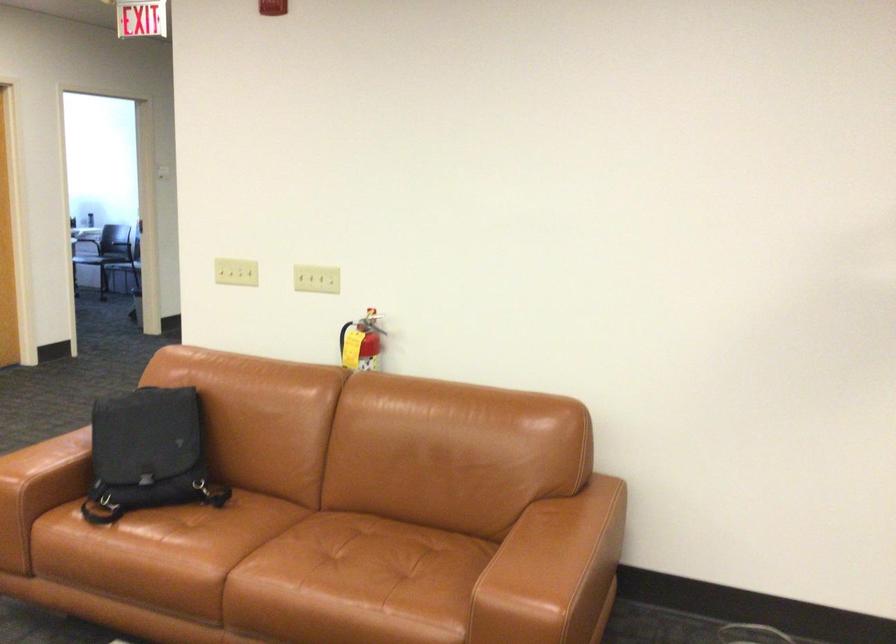
At what (x,y) coordinates should I click in order to perform the action: click on sofa sitting surface. Please return your answer as a coordinate pair (x, y). The width and height of the screenshot is (896, 644). Looking at the image, I should click on (350, 574).